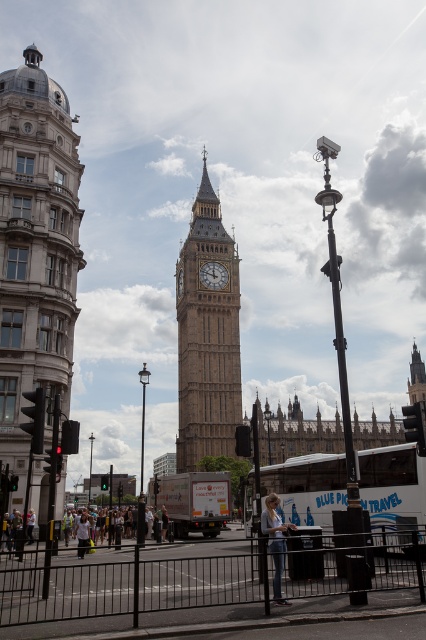
In the scene shown: Which of these two, golden stone clock tower at center or stone clock tower at center, stands taller?

golden stone clock tower at center

Is point (192, 355) closer to camera compared to point (210, 278)?

Yes, point (192, 355) is in front of point (210, 278).

Is point (218, 296) in front of point (226, 276)?

Yes, point (218, 296) is in front of point (226, 276).

Identify the location of golden stone clock tower at center. The height and width of the screenshot is (640, 426). (207, 337).

Does white matte bus at center appear on the left side of white cotton shirt at center?

No, white matte bus at center is not to the left of white cotton shirt at center.

Can you confirm if white matte bus at center is bigger than white cotton shirt at center?

Indeed, white matte bus at center has a larger size compared to white cotton shirt at center.

What do you see at coordinates (307, 486) in the screenshot? I see `white matte bus at center` at bounding box center [307, 486].

This screenshot has width=426, height=640. I want to click on white matte bus at center, so (x=307, y=486).

Does silver metallic building at left have a greater height compared to stone clock tower at center?

Correct, silver metallic building at left is much taller as stone clock tower at center.

Is silver metallic building at left thinner than stone clock tower at center?

Incorrect, silver metallic building at left's width is not less than stone clock tower at center's.

Is point (69, 305) farther from camera compared to point (206, 284)?

That is False.

Identify the location of silver metallic building at left. click(x=36, y=266).